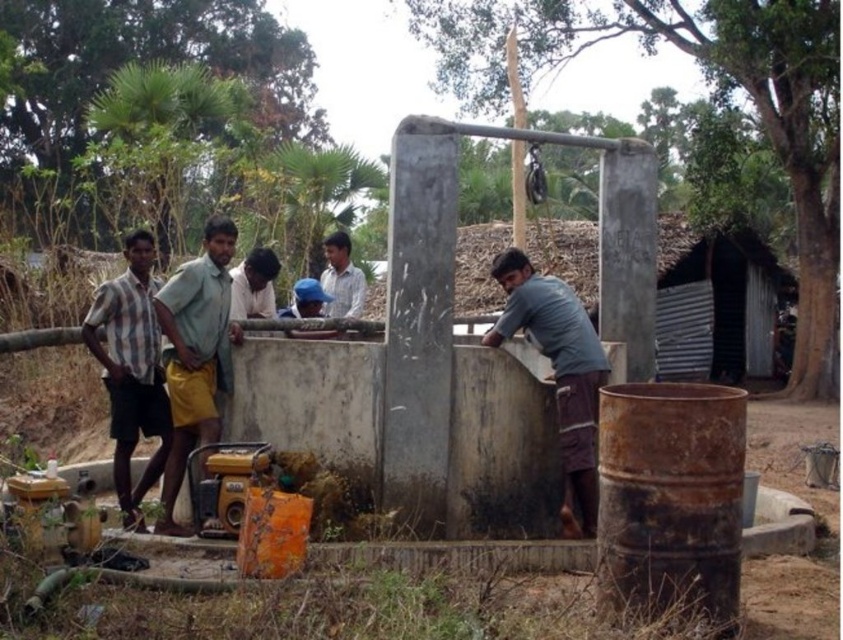
Is dark gray fabric shirt at center wider than light green fabric shirt at left?

Yes, dark gray fabric shirt at center is wider than light green fabric shirt at left.

In the scene shown: Can you confirm if dark gray fabric shirt at center is thinner than light green fabric shirt at left?

Incorrect, dark gray fabric shirt at center's width is not less than light green fabric shirt at left's.

This screenshot has width=843, height=640. I want to click on dark gray fabric shirt at center, so click(557, 372).

Which of these two, light green fabric shirt at left or light brown shirt at center, stands taller?

With more height is light green fabric shirt at left.

Is light green fabric shirt at left to the left of light brown shirt at center from the viewer's perspective?

Correct, you'll find light green fabric shirt at left to the left of light brown shirt at center.

Describe the element at coordinates (196, 355) in the screenshot. I see `light green fabric shirt at left` at that location.

The width and height of the screenshot is (843, 640). I want to click on light green fabric shirt at left, so click(196, 355).

Does white shirt at center appear under light brown shirt at center?

No, white shirt at center is not below light brown shirt at center.

Find the location of a particular element. white shirt at center is located at coordinates (341, 278).

This screenshot has width=843, height=640. I want to click on white shirt at center, so click(x=341, y=278).